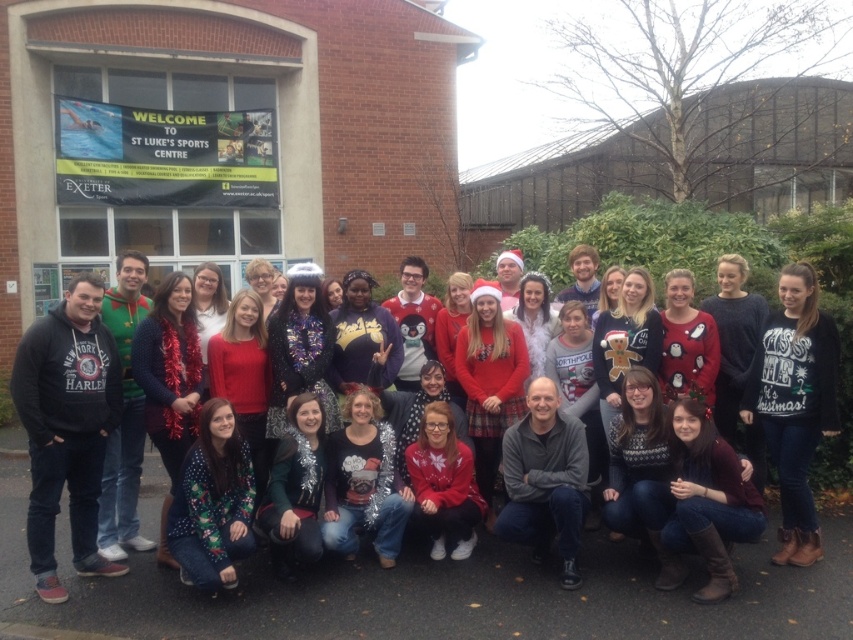
You are organizing a photo shoot and need to ensure that the white sweater at center and the brown leather boots at lower right are both visible in the frame. Based on their sizes, which object might require more space horizontally to fit properly in the photo?

The brown leather boots at lower right require more horizontal space because they are wider than the white sweater at center.

You are organizing a photo shoot for a winter fashion catalog and need to ensure that the white sweater at center and the brown leather boots at lower right are both visible in the frame. Based on their sizes, which item will appear larger in the final photo?

The white sweater at center will appear larger in the final photo because it is taller than the brown leather boots at lower right.